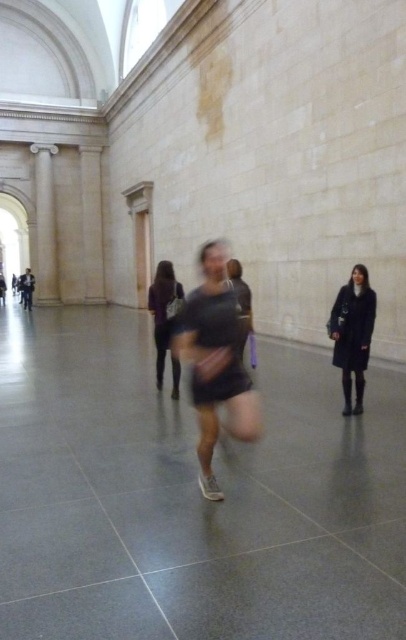
The image size is (406, 640). What do you see at coordinates (215, 362) in the screenshot? I see `black matte shirt at center` at bounding box center [215, 362].

Based on the photo, who is taller, black matte shirt at center or white marble pillar at left?

white marble pillar at left is taller.

Identify the location of black matte shirt at center. Image resolution: width=406 pixels, height=640 pixels. (215, 362).

Is black matte shirt at center taller than dark blue coat at right?

Indeed, black matte shirt at center has a greater height compared to dark blue coat at right.

Is point (209, 477) farther from camera compared to point (358, 314)?

That is False.

Does point (233, 392) lie behind point (352, 410)?

No, (233, 392) is in front of (352, 410).

What are the coordinates of `black matte shirt at center` in the screenshot? It's located at (215, 362).

Can you confirm if white marble pillar at left is positioned below dark gray fabric dress at center?

No.

Is white marble pillar at left shorter than dark gray fabric dress at center?

Incorrect, white marble pillar at left's height does not fall short of dark gray fabric dress at center's.

Locate an element on the screen. white marble pillar at left is located at coordinates (45, 224).